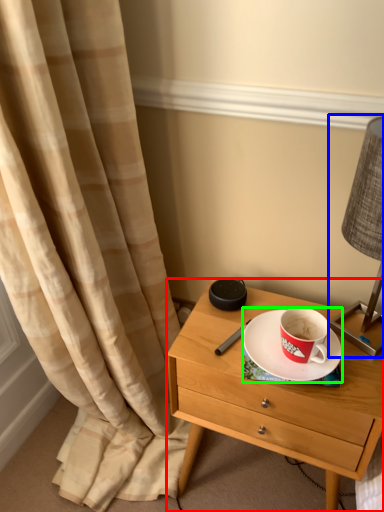
Question: Which object is positioned closest to nightstand (highlighted by a red box)? Select from bedside lamp (highlighted by a blue box) and saucer (highlighted by a green box).

Choices:
 (A) bedside lamp
 (B) saucer

Answer: (B)